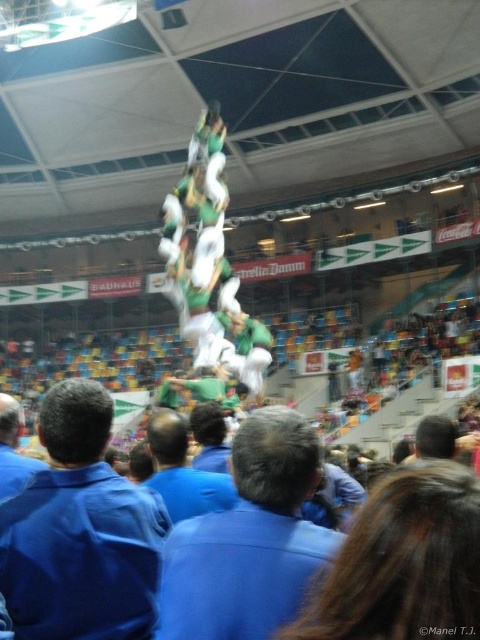
You are a photographer at the event and want to capture both the blue shirt at center and the blue shirt at lower left in a single shot. Which blue shirt should you focus on to ensure both are in frame without zooming in or out?

The blue shirt at center is larger in size than blue shirt at lower left, so you should focus on the blue shirt at lower left to ensure both are in frame without zooming in or out.

You are an event organizer planning to place a banner between the blue shirt at lower left and the green fabric man at center. Considering their sizes, which object should the banner be closer to?

The blue shirt at lower left occupies less space than the green fabric man at center, so the banner should be closer to the blue shirt at lower left to ensure proper visibility and balance.

You are a photographer at the arena and want to capture the human tower. You notice the green fabric shirt at center and the green fabric man at center in your viewfinder. Which object should you focus on to ensure the subject is in sharp focus if you want the closest object to you?

The green fabric shirt at center is closer to the viewer than the green fabric man at center, so you should focus on the green fabric shirt at center to ensure the closest object is in sharp focus.